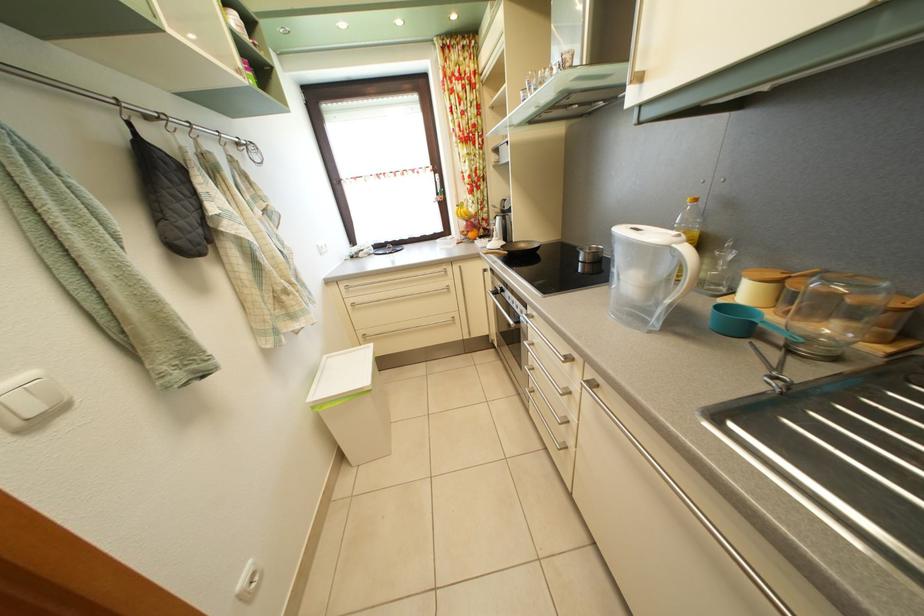
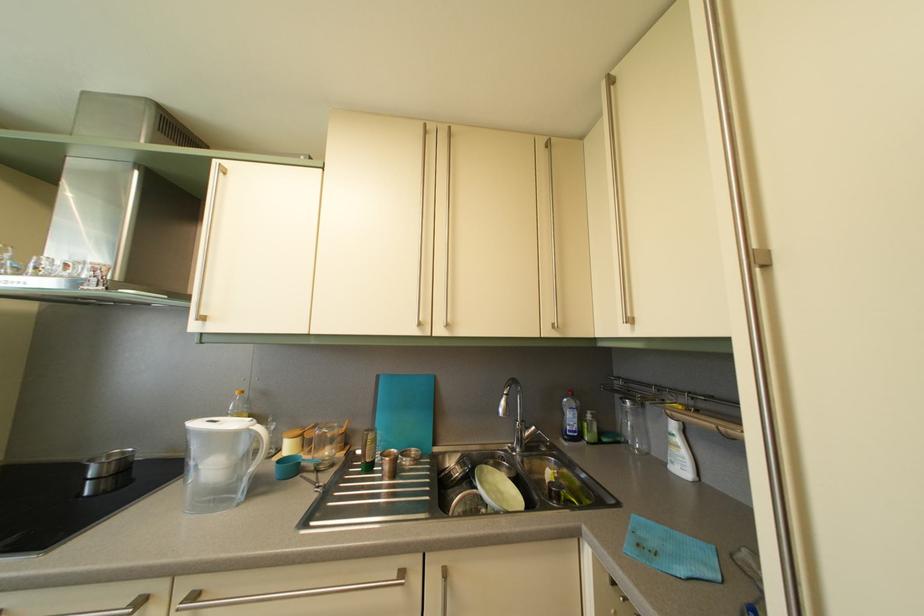
The point at (599,256) is marked in the first image. Where is the corresponding point in the second image?

(118, 463)